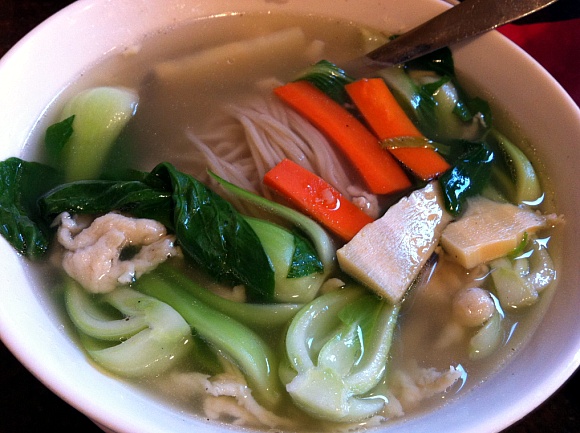
Locate an element on the screen. inside of bowl is located at coordinates (55, 71).